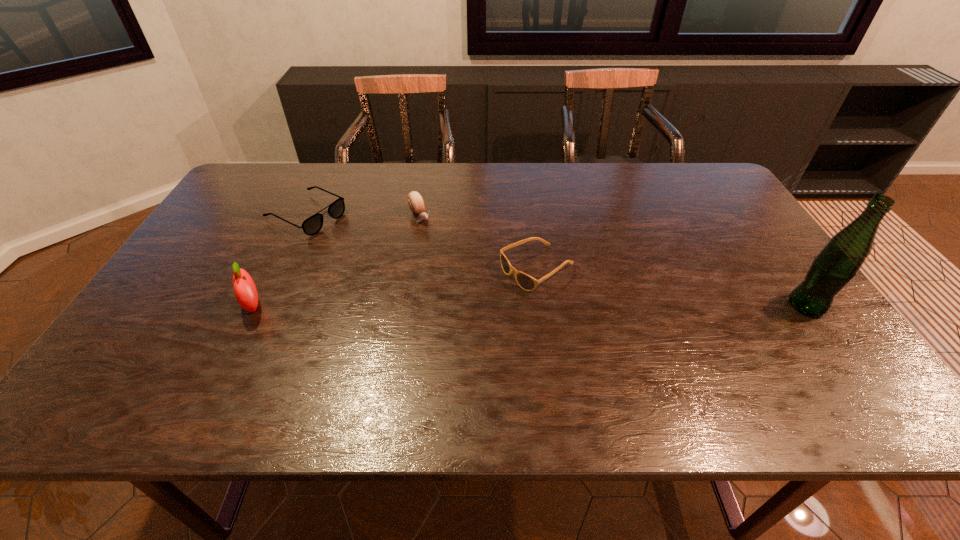
I want to click on vacant area that lies between the sunglasses and the third object from right to left, so click(479, 244).

Locate an element on the screen. The image size is (960, 540). empty space between the rightmost object and the spectacles is located at coordinates (557, 260).

What are the coordinates of `blank region between the fourth shortest object and the beer bottle` in the screenshot? It's located at (530, 306).

Image resolution: width=960 pixels, height=540 pixels. I want to click on vacant space that's between the apple and the tallest object, so click(x=530, y=306).

You are a GUI agent. You are given a task and a screenshot of the screen. Output one action in this format:
    pyautogui.click(x=<x>, y=<y>)
    Task: Click on the blank region between the third shortest object and the spectacles
    
    Given the screenshot: What is the action you would take?
    pyautogui.click(x=363, y=216)

You are a GUI agent. You are given a task and a screenshot of the screen. Output one action in this format:
    pyautogui.click(x=<x>, y=<y>)
    Task: Click on the free space between the sunglasses and the spectacles
    This screenshot has height=540, width=960.
    Given the screenshot: What is the action you would take?
    pyautogui.click(x=421, y=242)

Identify the location of free area in between the fourth shortest object and the spectacles. Image resolution: width=960 pixels, height=540 pixels. (279, 260).

Identify which object is the fourth closest to the third tallest object. Please provide its 2D coordinates. Your answer should be formatted as a tuple, i.e. [(x, y)], where the tuple contains the x and y coordinates of a point satisfying the conditions above.

[(837, 264)]

Locate which object is the second closest to the second tallest object. Please provide its 2D coordinates. Your answer should be formatted as a tuple, i.e. [(x, y)], where the tuple contains the x and y coordinates of a point satisfying the conditions above.

[(415, 201)]

Locate an element on the screen. This screenshot has width=960, height=540. vacant area in the image that satisfies the following two spatial constraints: 1. on the back side of the third object from right to left; 2. on the right side of the apple is located at coordinates (297, 218).